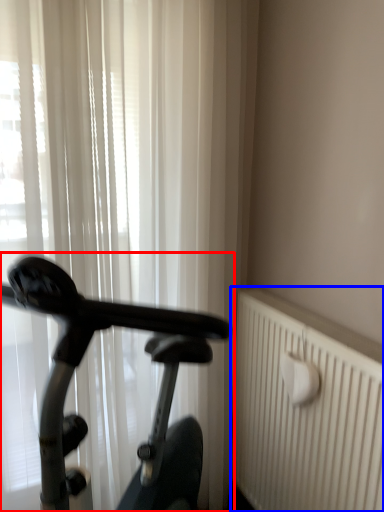
Question: Among these objects, which one is farthest to the camera, bicycle (highlighted by a red box) or radiator (highlighted by a blue box)?

Choices:
 (A) bicycle
 (B) radiator

Answer: (B)